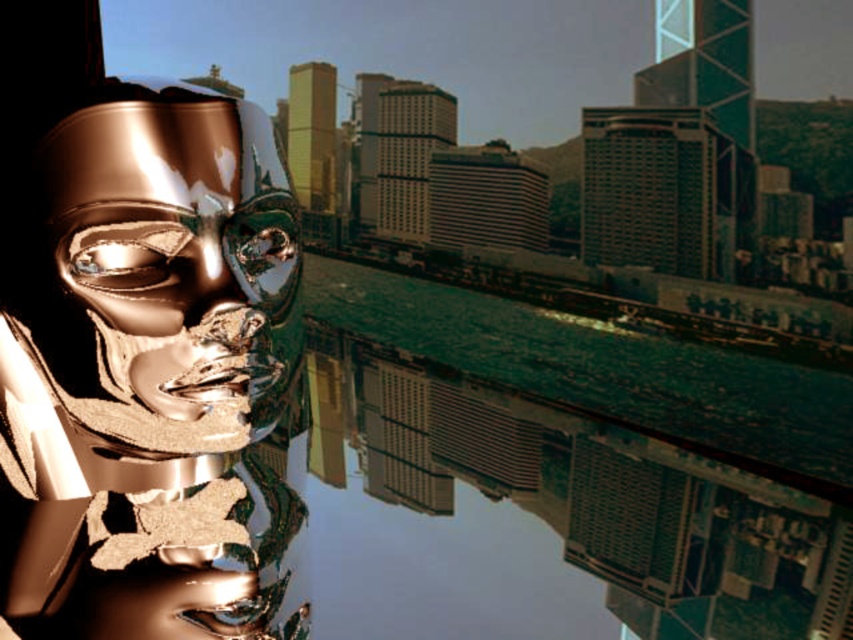
Question: Which of the following is the farthest from the observer?

Choices:
 (A) shiny gold mask at center
 (B) green reflective water at center

Answer: (A)

Question: Can you confirm if green reflective water at center is positioned above shiny gold mask at center?

Choices:
 (A) no
 (B) yes

Answer: (A)

Question: Among these objects, which one is farthest from the camera?

Choices:
 (A) green reflective water at center
 (B) shiny gold mask at center

Answer: (B)

Question: Which point is farther to the camera?

Choices:
 (A) (637, 545)
 (B) (254, 193)

Answer: (A)

Question: Does green reflective water at center appear over shiny gold mask at center?

Choices:
 (A) no
 (B) yes

Answer: (A)

Question: Does green reflective water at center have a larger size compared to shiny gold mask at center?

Choices:
 (A) no
 (B) yes

Answer: (B)